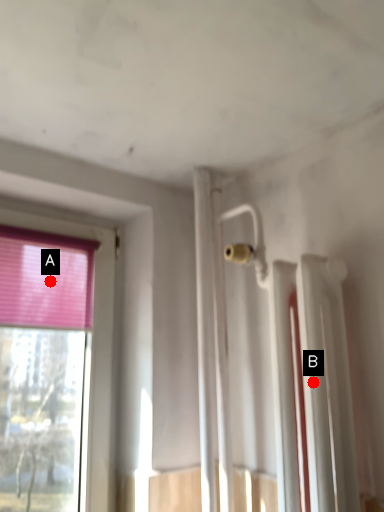
Question: Two points are circled on the image, labeled by A and B beside each circle. Which point is farther to the camera?

Choices:
 (A) A is further
 (B) B is further

Answer: (A)